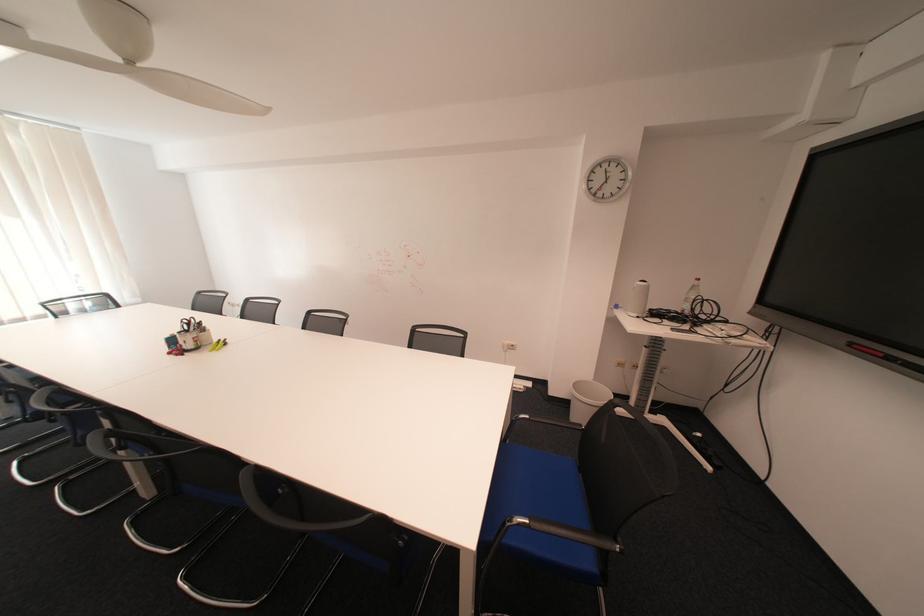
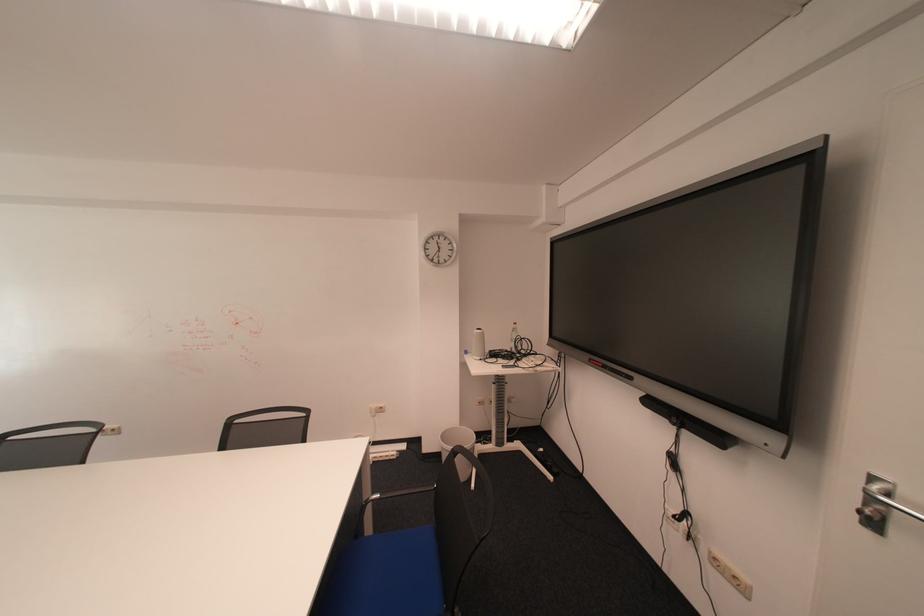
Where in the second image is the point corresponding to the point at 588,387 from the first image?

(456, 437)